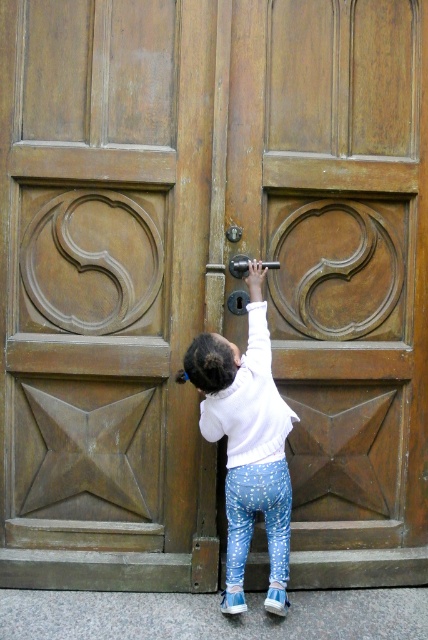
Question: Can you confirm if white soft sweater at center is positioned above polished brass door handle at center?

Choices:
 (A) no
 (B) yes

Answer: (A)

Question: Is white soft sweater at center to the left of polished brass door handle at center from the viewer's perspective?

Choices:
 (A) yes
 (B) no

Answer: (B)

Question: Which point appears closest to the camera in this image?

Choices:
 (A) (214, 268)
 (B) (259, 330)

Answer: (B)

Question: Which point is closer to the camera?

Choices:
 (A) (258, 268)
 (B) (211, 272)

Answer: (A)

Question: Can you confirm if white soft sweater at center is smaller than polished brass door handle at center?

Choices:
 (A) no
 (B) yes

Answer: (A)